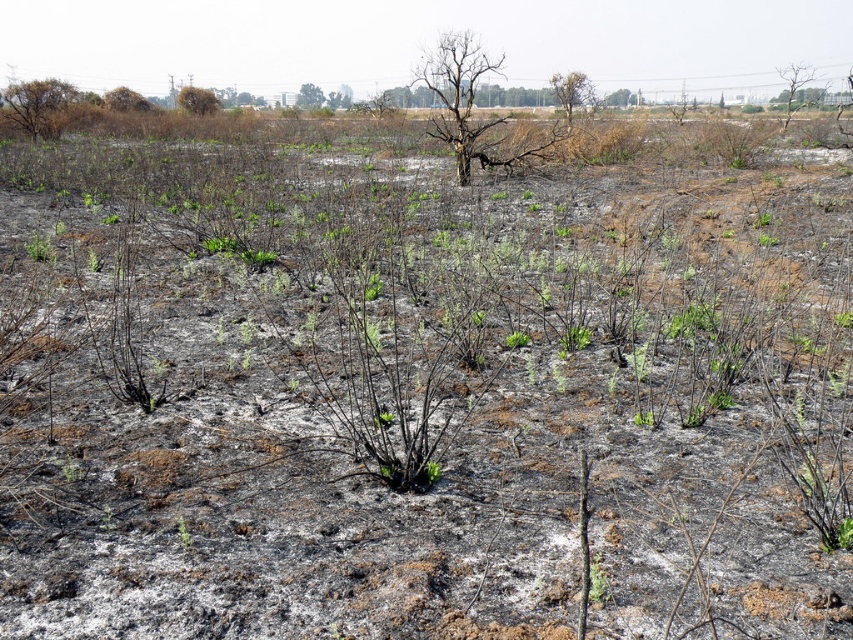
Question: Based on their relative distances, which object is farther from the charcoal-barked tree at upper right?

Choices:
 (A) brown dry wood at upper center
 (B) bare branches at center
 (C) brown dry tree at upper left

Answer: (C)

Question: Is brown dry wood at upper center closer to the viewer compared to brown charred tree at upper left?

Choices:
 (A) yes
 (B) no

Answer: (A)

Question: Observing the image, what is the correct spatial positioning of burnt wood tree at upper left in reference to brown dry wood at upper center?

Choices:
 (A) left
 (B) right

Answer: (A)

Question: Can you confirm if brown dry wood at upper center is thinner than bare branches at center?

Choices:
 (A) yes
 (B) no

Answer: (B)

Question: Based on their relative distances, which object is farther from the bare branches at center?

Choices:
 (A) brown dry wood at upper center
 (B) charcoal-barked tree at upper right
 (C) brown dry tree at upper left
 (D) brown charred tree at upper left

Answer: (B)

Question: Which point is farther from the camera taking this photo?

Choices:
 (A) (556, 72)
 (B) (318, 90)
 (C) (196, 113)

Answer: (A)